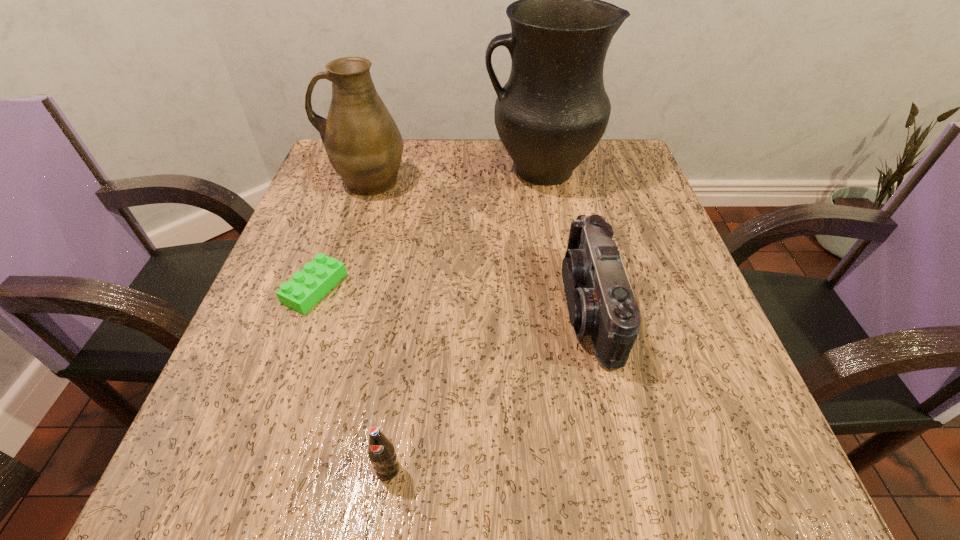
This screenshot has height=540, width=960. I want to click on vacant space that satisfies the following two spatial constraints: 1. on the handle side of the tallest object; 2. on the front side of the shortest object, so click(x=561, y=288).

Find the location of a particular element. This screenshot has width=960, height=540. free space that satisfies the following two spatial constraints: 1. on the handle side of the tallest object; 2. on the front label of the pop is located at coordinates (591, 469).